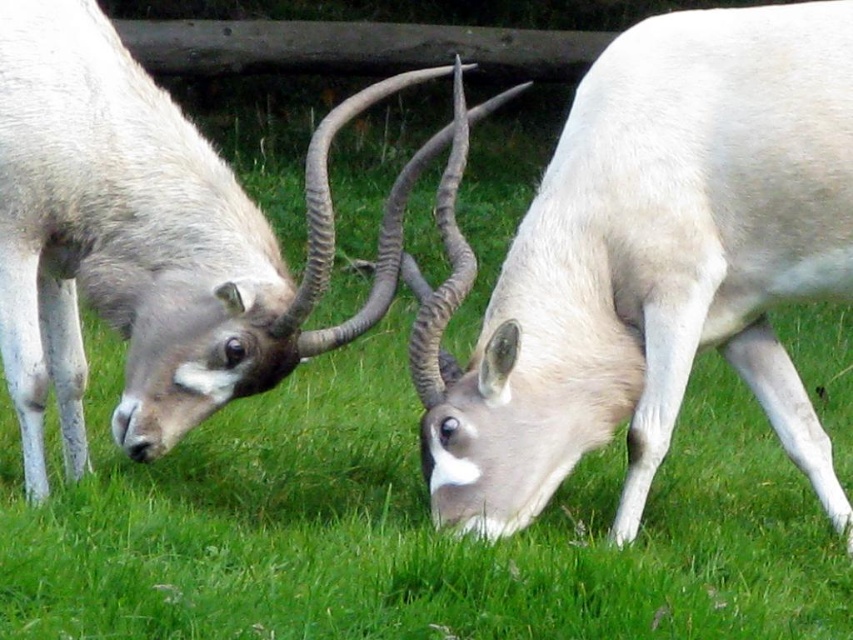
Question: Is white matte antelope at center to the right of smooth white antelope at center from the viewer's perspective?

Choices:
 (A) yes
 (B) no

Answer: (A)

Question: Is white matte antelope at center smaller than smooth white antelope at center?

Choices:
 (A) no
 (B) yes

Answer: (B)

Question: Which object is farther from the camera taking this photo?

Choices:
 (A) smooth white antelope at center
 (B) white matte antelope at center

Answer: (A)

Question: Is white matte antelope at center behind smooth white antelope at center?

Choices:
 (A) yes
 (B) no

Answer: (B)